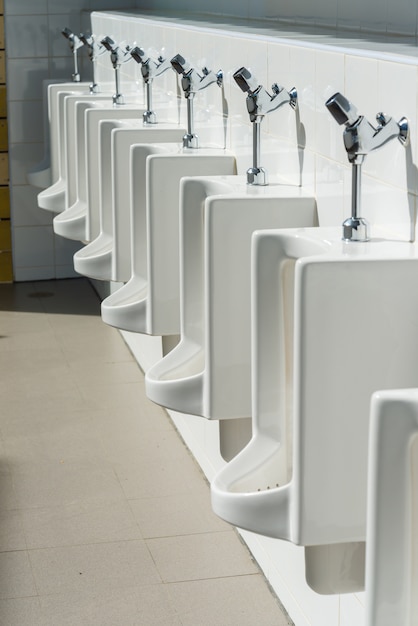
This screenshot has height=626, width=418. Find the location of `urinals`. urinals is located at coordinates (401, 557), (264, 476), (206, 344), (152, 250), (109, 221), (86, 196), (64, 183), (51, 166).